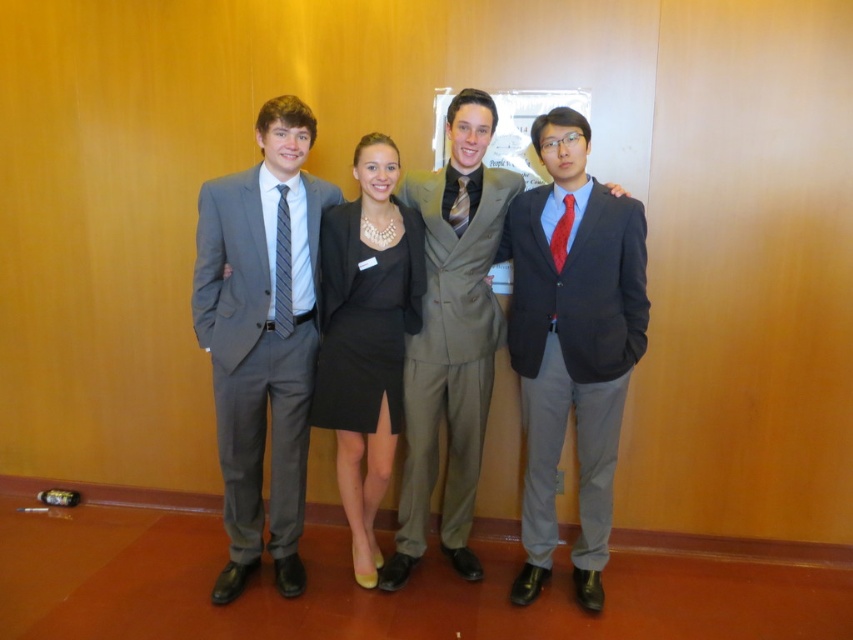
You are organizing a charity event and need to arrange name tags for all attendees. The name tags must be placed on the tallest tie among the striped silk tie at center and the yellow striped tie at center. Which tie should you choose?

The striped silk tie at center is much taller than the yellow striped tie at center, so you should place the name tag on the striped silk tie at center.

Looking at this image, you are organizing a charity event and need to ensure that all participants have ties of the same width. You notice two ties in the image, the striped silk tie at center and the yellow striped tie at center. Which tie should be adjusted to match the other in terms of width?

The striped silk tie at center is thinner than the yellow striped tie at center. To match the widths, the yellow striped tie at center should be adjusted to be thinner, or the striped silk tie at center should be made wider. However, since adjusting existing ties may not be practical, it would be best to select ties of uniform width for all participants.